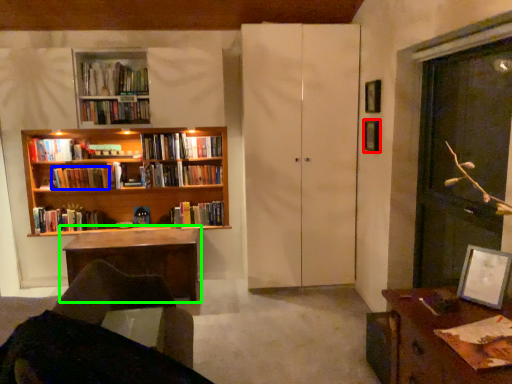
Question: Estimate the real-world distances between objects in this image. Which object is farther from picture frame (highlighted by a red box), book (highlighted by a blue box) or table (highlighted by a green box)?

Choices:
 (A) book
 (B) table

Answer: (A)